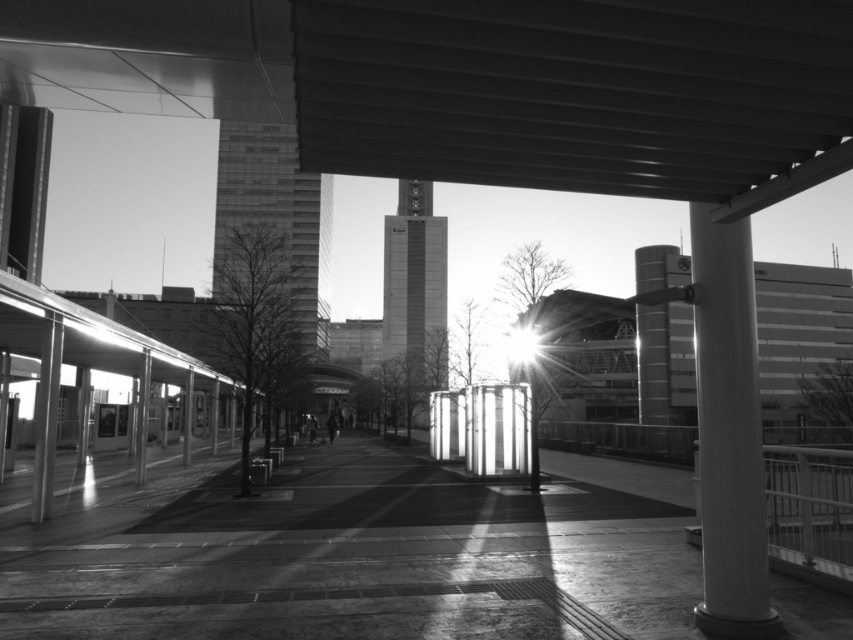
Question: Is smooth concrete pavement at center to the right of smooth white column at right from the viewer's perspective?

Choices:
 (A) yes
 (B) no

Answer: (B)

Question: Among these points, which one is farthest from the camera?

Choices:
 (A) (695, 356)
 (B) (471, 586)
 (C) (561, 76)

Answer: (B)

Question: Does metallic roof at upper center appear over smooth concrete pavement at center?

Choices:
 (A) yes
 (B) no

Answer: (A)

Question: Which point is closer to the camera?

Choices:
 (A) (677, 636)
 (B) (775, 632)

Answer: (B)

Question: Which object is the closest to the smooth concrete pavement at center?

Choices:
 (A) metallic roof at upper center
 (B) smooth white column at right

Answer: (B)

Question: Does metallic roof at upper center appear under smooth gray pillar at right?

Choices:
 (A) no
 (B) yes

Answer: (A)